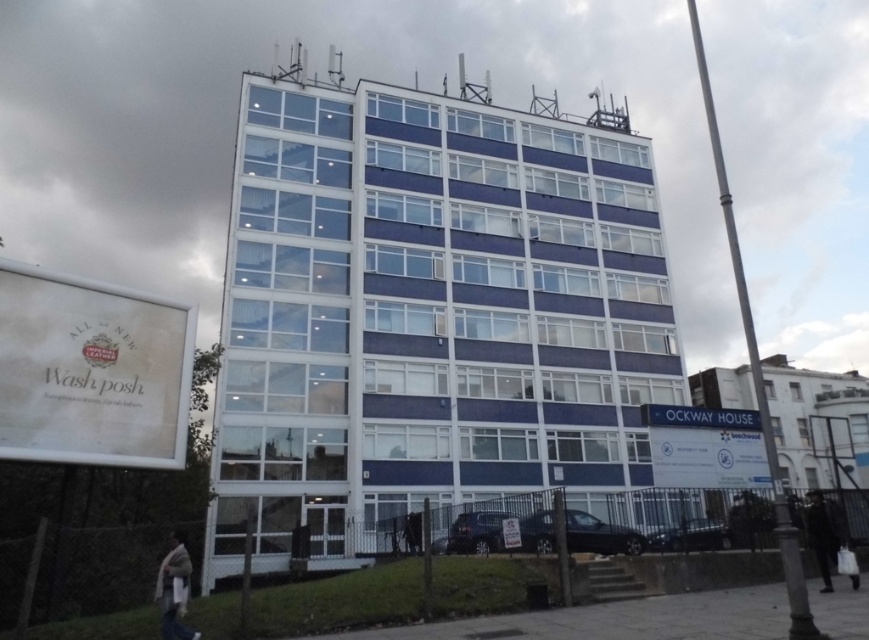
You are standing in front of the building and see the beige knitted scarf at lower left and the dark wool coat at lower right. Which object is taller?

The beige knitted scarf at lower left is not as tall as the dark wool coat at lower right, so the dark wool coat at lower right is taller.

You are standing in front of the building and want to take a photo that includes both the point at coordinates point (x=173, y=600) and the point at coordinates point (x=823, y=544). Since you want to ensure both points are in focus, which point should you focus on to make sure the other is also in focus?

You should focus on the point closer to the camera, which is point (x=173, y=600). This ensures that the depth of field will cover both points, including the farther point (x=823, y=544).